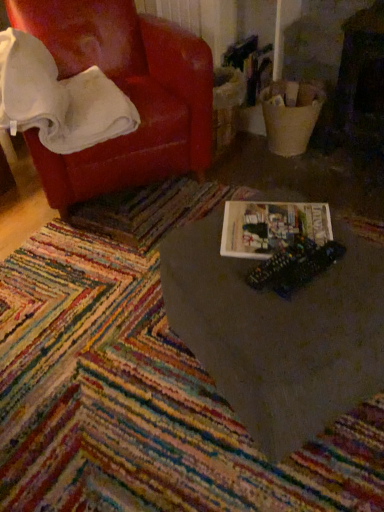
Where is `vacant region to the left of metallic plastic toy at center`? This screenshot has width=384, height=512. vacant region to the left of metallic plastic toy at center is located at coordinates (228, 283).